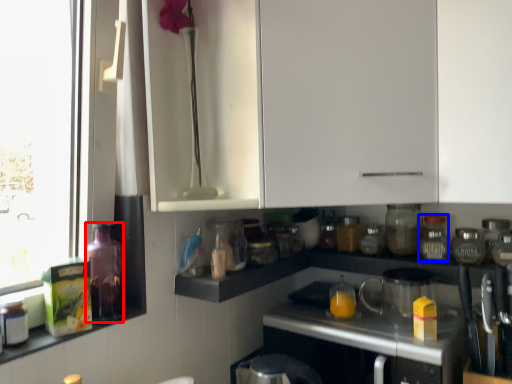
Question: Among these objects, which one is nearest to the camera, bottle (highlighted by a red box) or bottle (highlighted by a blue box)?

Choices:
 (A) bottle
 (B) bottle

Answer: (A)